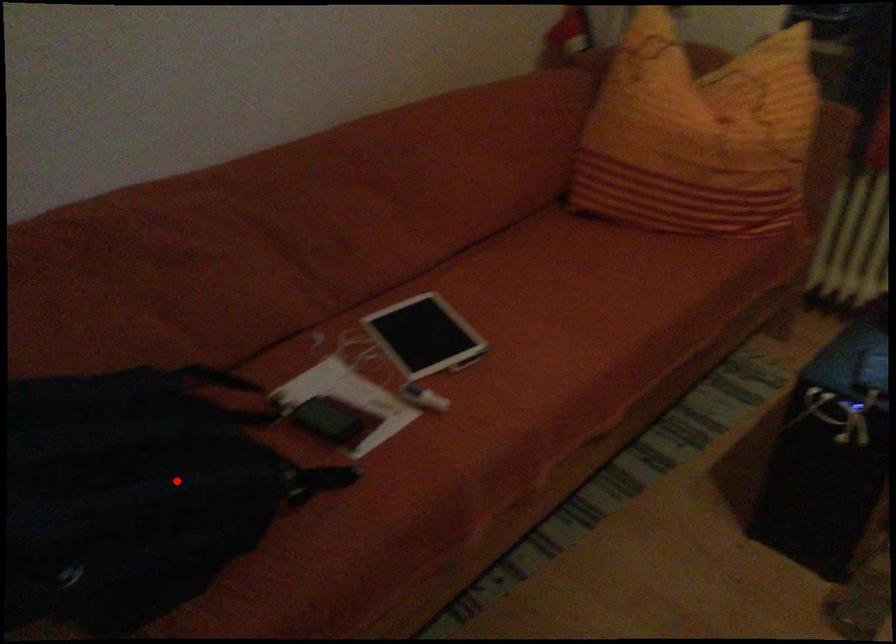
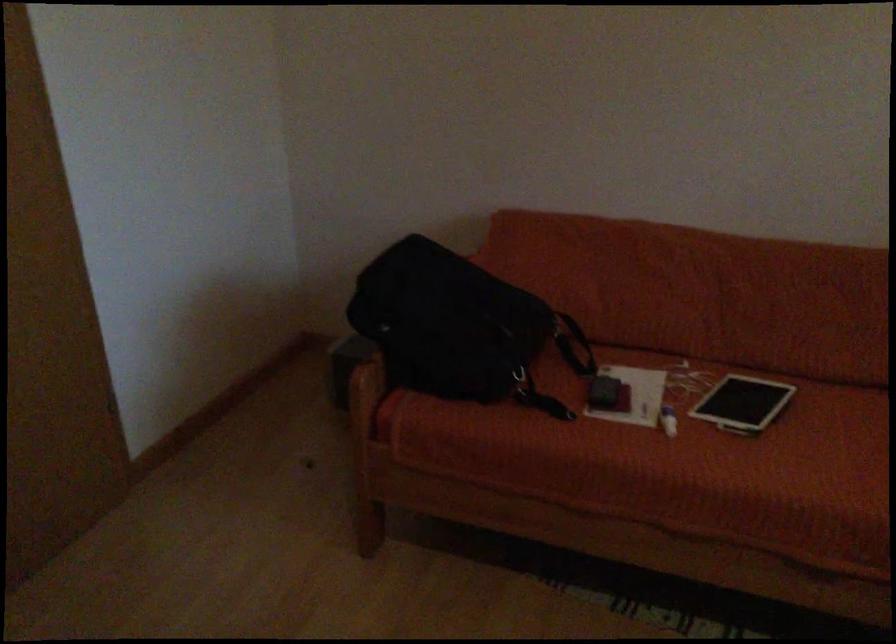
Question: I am providing you with two images of the same scene from different viewpoints. A red point is shown in image1. For the corresponding object point in image2, is it positioned nearer or farther from the camera?

Choices:
 (A) Nearer
 (B) Farther

Answer: (B)